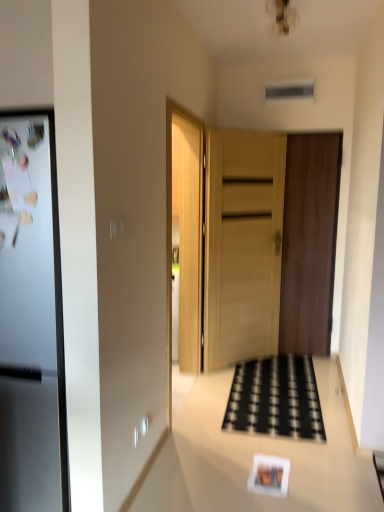
Question: In the image, is black woven mat at center on the left side or the right side of dark brown wood door at center, the 1th door from the right?

Choices:
 (A) left
 (B) right

Answer: (A)

Question: Relative to dark brown wood door at center, the 1th door from the right, is black woven mat at center in front or behind?

Choices:
 (A) behind
 (B) front

Answer: (B)

Question: Which of these objects is positioned closest to the matte paper postcard at lower center?

Choices:
 (A) dark brown wood door at center, the second door viewed from the left
 (B) black woven mat at center
 (C) sleek metallic fridge at left
 (D) wooden door at center, which is the first door from left to right
 (E) white glossy counter top at center

Answer: (E)

Question: Which is nearer to the wooden door at center, which appears as the 2th door when viewed from the right?

Choices:
 (A) black woven mat at center
 (B) sleek metallic fridge at left
 (C) dark brown wood door at center, the second door viewed from the left
 (D) matte paper postcard at lower center
 (E) white glossy counter top at center

Answer: (C)